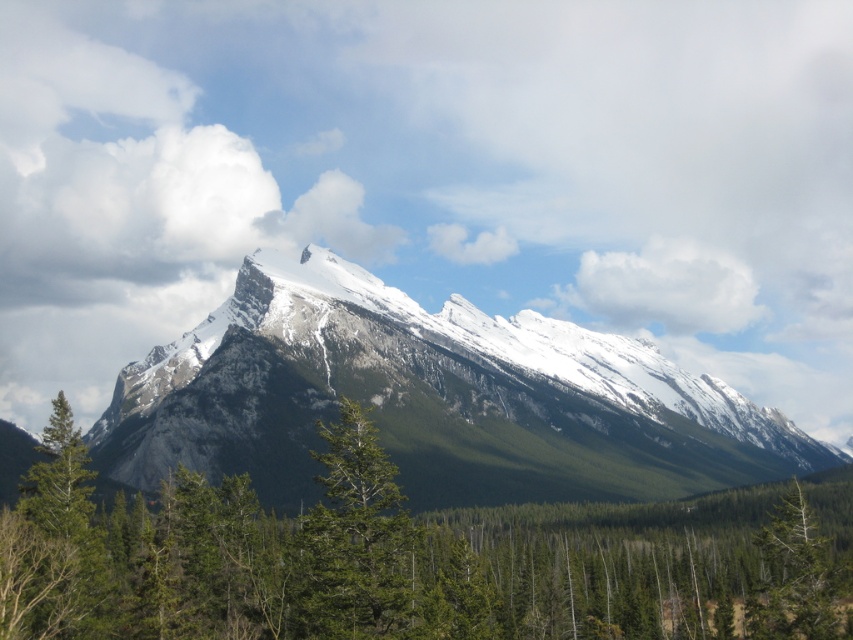
You are a hiker planning to take a photo of the snowy granite mountain range at center and the green matte tree at lower right. Which object should you focus on first if you want to capture both in the same frame without moving the camera?

The snowy granite mountain range at center is positioned over the green matte tree at lower right, so you should focus on the snowy granite mountain range at center first to ensure it remains in the frame while adjusting for depth of field.

You are planning a hiking trip and want to know if the snowy granite mountain range at center is taller than the green matte tree at lower right. Can you confirm this?

The snowy granite mountain range at center has a greater height compared to the green matte tree at lower right, so yes, the snowy granite mountain range at center is taller than the green matte tree at lower right.

In the scene shown: You are a hiker standing in the dense forest of the image. You want to reach the highest point of the snowy granite mountain range at center. Which direction should you head towards relative to the green matte tree at lower right?

The snowy granite mountain range at center is positioned on the left side of green matte tree at lower right. To reach the highest point of the snowy granite mountain range at center, you should head towards the left direction relative to the green matte tree at lower right.